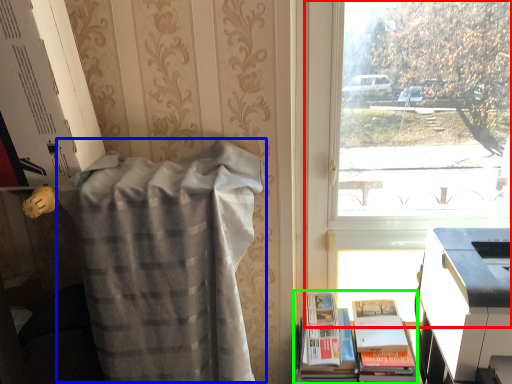
Question: Which is farther away from window (highlighted by a red box)? blanket (highlighted by a blue box) or book (highlighted by a green box)?

Choices:
 (A) blanket
 (B) book

Answer: (B)